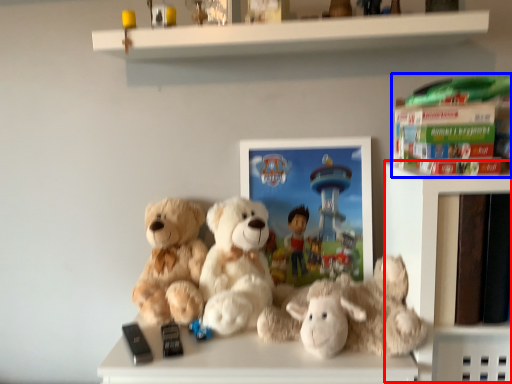
Question: Among these objects, which one is nearest to the camera, shelf (highlighted by a red box) or book (highlighted by a blue box)?

Choices:
 (A) shelf
 (B) book

Answer: (B)